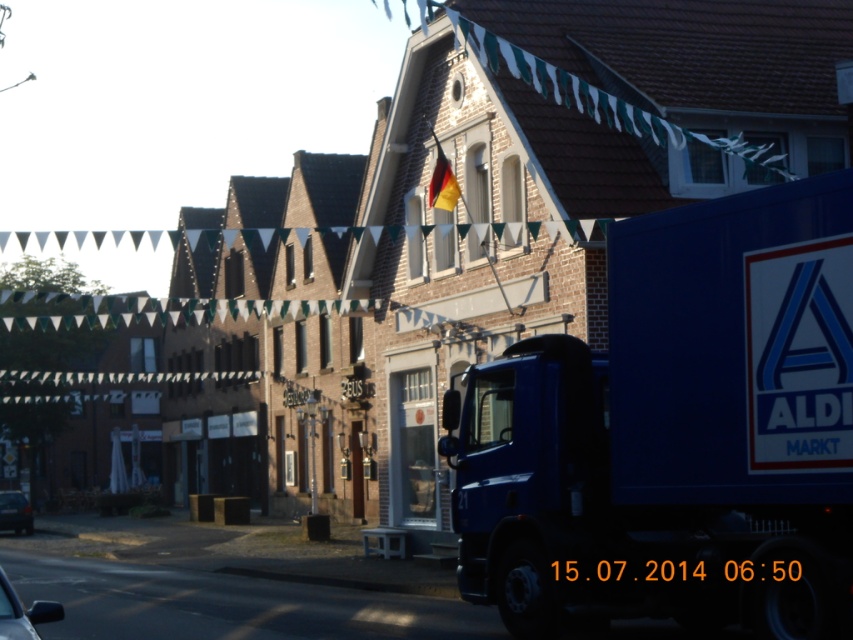
Which is below, blue matte truck at center or german flag at upper center?

blue matte truck at center is lower down.

Is blue matte truck at center further to the viewer compared to german flag at upper center?

No, it is in front of german flag at upper center.

Locate an element on the screen. Image resolution: width=853 pixels, height=640 pixels. blue matte truck at center is located at coordinates (675, 432).

Does blue matte truck at center have a larger size compared to shiny black car at lower left?

No, blue matte truck at center is not bigger than shiny black car at lower left.

Is point (759, 576) farther from camera compared to point (7, 580)?

No, it is not.

At what (x,y) coordinates should I click in order to perform the action: click on blue matte truck at center. Please return your answer as a coordinate pair (x, y). Looking at the image, I should click on (675, 432).

Who is more forward, (763, 497) or (22, 529)?

Positioned in front is point (763, 497).

Is blue matte truck at center wider than metallic silver car at lower left?

Yes, blue matte truck at center is wider than metallic silver car at lower left.

I want to click on blue matte truck at center, so point(675,432).